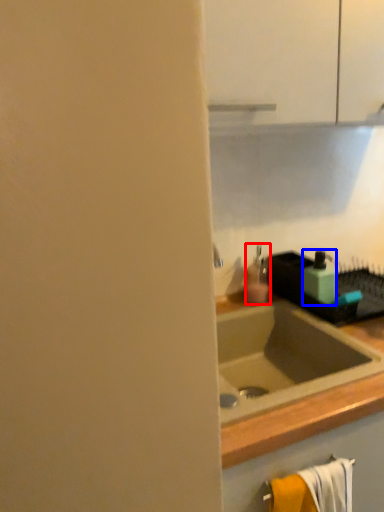
Question: Which object appears closest to the camera in this image, soap dispenser (highlighted by a red box) or soap dispenser (highlighted by a blue box)?

Choices:
 (A) soap dispenser
 (B) soap dispenser

Answer: (B)